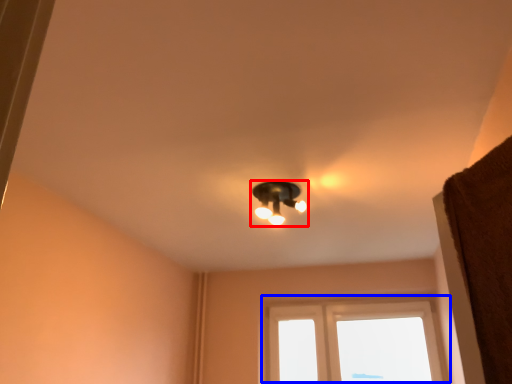
Question: Among these objects, which one is farthest to the camera, lamp (highlighted by a red box) or window (highlighted by a blue box)?

Choices:
 (A) lamp
 (B) window

Answer: (B)